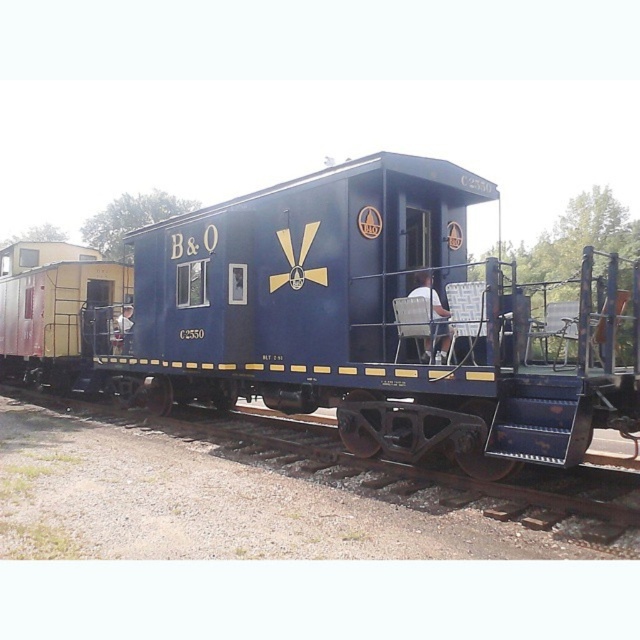
Based on the photo, you are a railway inspector checking the caboose and its surroundings. You notice the rusty metal track at lower center and the white fabric chair at center. Which object is shorter in length?

The rusty metal track at lower center is shorter than the white fabric chair at center.

You are a photographer setting up equipment in the caboose. You have a matte blue caboose at center and a white fabric chair at center. Which object should you avoid placing heavy items on to prevent damage?

The white fabric chair at center should be avoided for placing heavy items because the matte blue caboose at center is larger and likely more structurally sound.

You are a railway inspector checking the caboose and its surroundings. You notice the rusty metal track at lower center and the white fabric chair at center. Which object is wider?

The rusty metal track at lower center is wider than the white fabric chair at center.